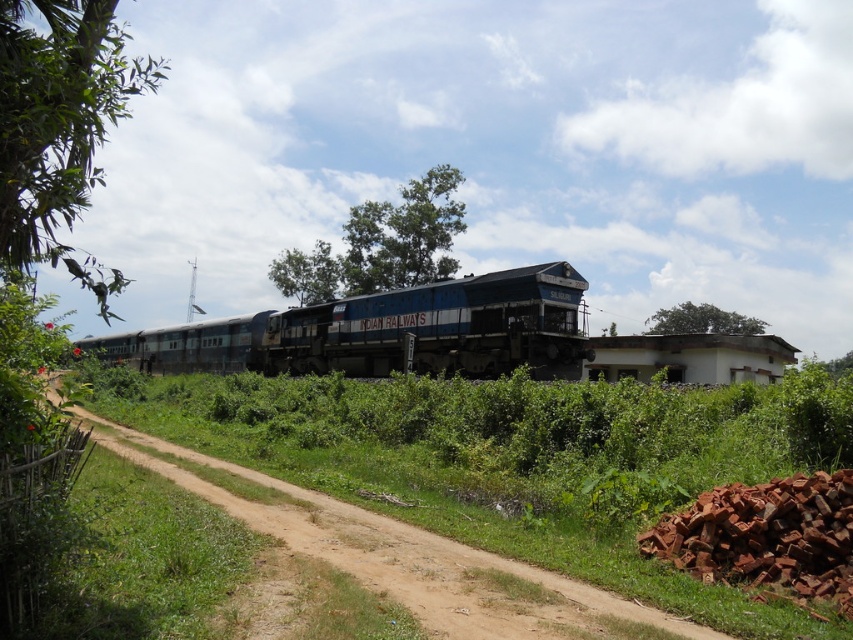
Question: Is green leafy tree at center to the left of green leafy tree at upper center from the viewer's perspective?

Choices:
 (A) no
 (B) yes

Answer: (B)

Question: Is blue painted steel train at center smaller than brown dirt track at center?

Choices:
 (A) no
 (B) yes

Answer: (A)

Question: Which object appears farthest from the camera in this image?

Choices:
 (A) brown dirt track at center
 (B) blue painted steel train at center
 (C) green leafy tree at upper left
 (D) green leafy tree at upper center

Answer: (D)

Question: Can you confirm if brown dirt track at center is thinner than green leafy tree at center?

Choices:
 (A) no
 (B) yes

Answer: (B)

Question: Which object is positioned closest to the brown dirt track at center?

Choices:
 (A) blue painted steel train at center
 (B) green leafy tree at center
 (C) green leafy tree at upper left
 (D) green leafy tree at upper center

Answer: (A)

Question: Which object appears closest to the camera in this image?

Choices:
 (A) green leafy tree at upper center
 (B) brown dirt track at center
 (C) green leafy tree at upper left

Answer: (C)